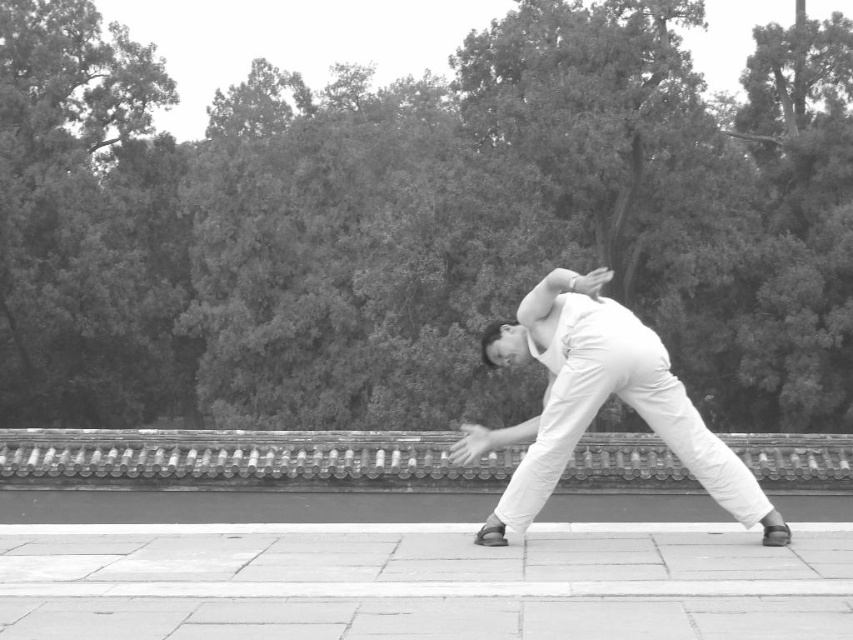
Between smooth concrete pavement at lower center and white cotton pants at center, which one has more height?

With more height is white cotton pants at center.

Is point (718, 548) positioned in front of point (750, 488)?

Yes, point (718, 548) is closer to viewer.

At what (x,y) coordinates should I click in order to perform the action: click on smooth concrete pavement at lower center. Please return your answer as a coordinate pair (x, y). The width and height of the screenshot is (853, 640). Looking at the image, I should click on (428, 584).